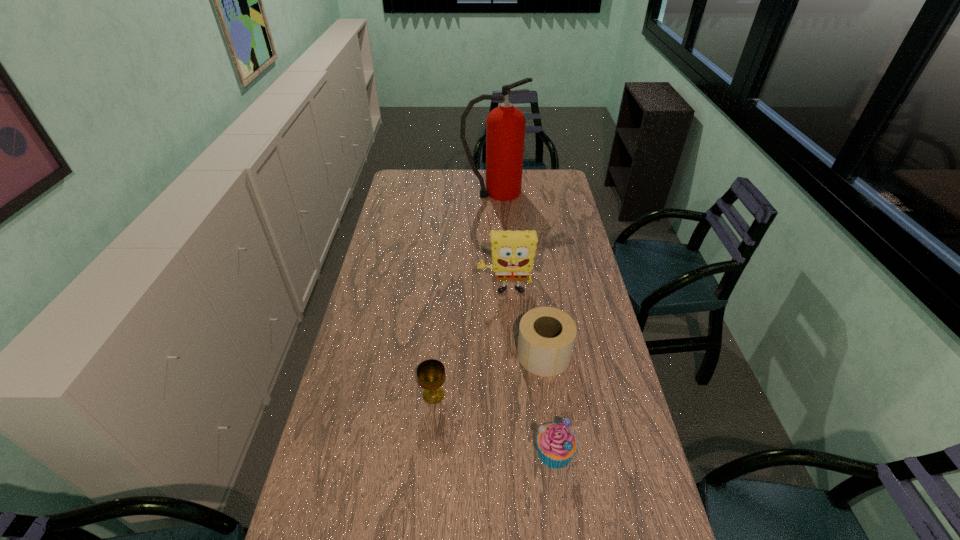
This screenshot has width=960, height=540. In order to click on the farthest object in this screenshot , I will do `click(505, 125)`.

What are the coordinates of `fire extinguisher` in the screenshot? It's located at (505, 125).

The height and width of the screenshot is (540, 960). In order to click on sponge in this screenshot , I will do `click(513, 252)`.

Identify the location of the second tallest object. The width and height of the screenshot is (960, 540). (513, 252).

Image resolution: width=960 pixels, height=540 pixels. I want to click on the third nearest object, so click(547, 335).

You are a GUI agent. You are given a task and a screenshot of the screen. Output one action in this format:
    pyautogui.click(x=<x>, y=<y>)
    Task: Click on the leftmost object
    
    Given the screenshot: What is the action you would take?
    pyautogui.click(x=431, y=375)

Image resolution: width=960 pixels, height=540 pixels. Find the location of `the fourth farthest object`. the fourth farthest object is located at coordinates (431, 375).

The height and width of the screenshot is (540, 960). In order to click on the nearest object in this screenshot , I will do `click(557, 444)`.

Where is `free space located on the handle side of the farthest object`? Image resolution: width=960 pixels, height=540 pixels. free space located on the handle side of the farthest object is located at coordinates (543, 192).

The image size is (960, 540). In order to click on free space located on the face of the sponge in this screenshot , I will do `click(506, 314)`.